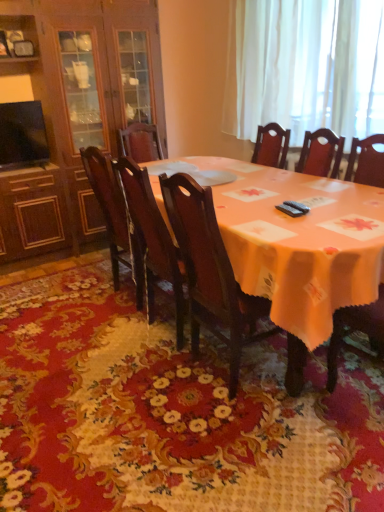
Question: From a real-world perspective, is white sheer curtain at upper right physically located above or below dark wood chair at center, which ranks as the 2th chair in left-to-right order?

Choices:
 (A) above
 (B) below

Answer: (A)

Question: Is point (288, 87) closer or farther from the camera than point (167, 254)?

Choices:
 (A) closer
 (B) farther

Answer: (B)

Question: Considering the real-world distances, which object is closest to the white sheer curtain at upper right?

Choices:
 (A) polished dark wood chair at center, marked as the 1th chair in a left-to-right arrangement
 (B) matte orange tablecloth at center
 (C) floral carpet at center
 (D) dark wood chair at center, which is counted as the 2th chair, starting from the right
 (E) dark wood chair at center, which is counted as the first chair, starting from the right

Answer: (B)

Question: Estimate the real-world distances between objects in this image. Which object is closer to the wooden cabinet at left?

Choices:
 (A) polished dark wood chair at center, marked as the 1th chair in a left-to-right arrangement
 (B) dark wood chair at center, which ranks as the 2th chair in left-to-right order
 (C) white sheer curtain at upper right
 (D) floral carpet at center
 (E) matte orange tablecloth at center

Answer: (A)